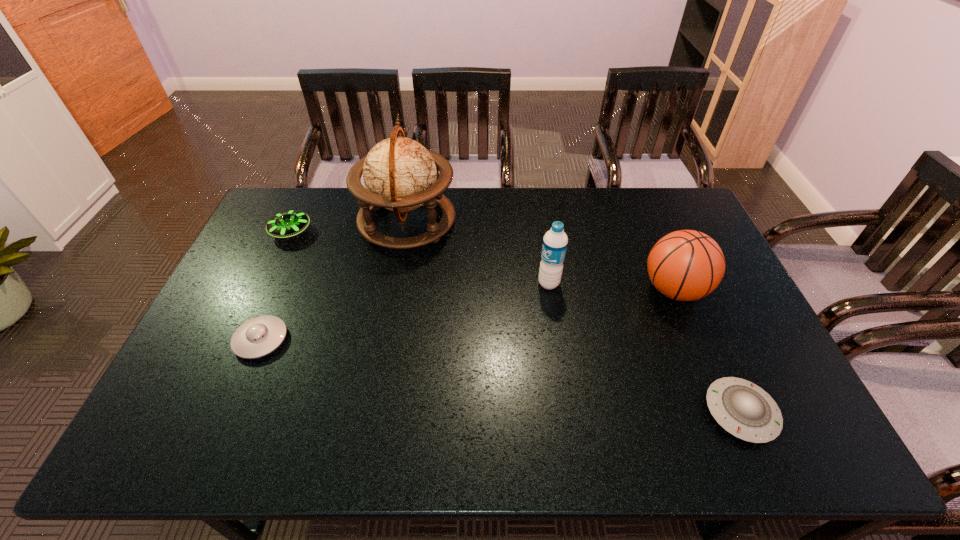
This screenshot has width=960, height=540. I want to click on free area in between the third object from right to left and the globe, so click(x=478, y=253).

Where is `vacant space that's between the basketball and the third object from right to left`? vacant space that's between the basketball and the third object from right to left is located at coordinates (612, 287).

Identify the location of vacant space that's between the third shortest object and the tallest object. The width and height of the screenshot is (960, 540). (349, 227).

Locate an element on the screen. This screenshot has height=540, width=960. vacant space that's between the fourth object from left to right and the tallest saucer is located at coordinates (420, 258).

The height and width of the screenshot is (540, 960). In order to click on vacant space that's between the tallest object and the nearest saucer in this screenshot , I will do `click(574, 317)`.

Identify the location of free space that is in between the second nearest saucer and the fourth tallest object. Image resolution: width=960 pixels, height=540 pixels. pos(276,286).

You are a GUI agent. You are given a task and a screenshot of the screen. Output one action in this format:
    pyautogui.click(x=<x>, y=<y>)
    Task: Click on the vacant area that lies between the fifth farthest object and the third object from left to right
    The image size is (960, 540).
    Given the screenshot: What is the action you would take?
    pyautogui.click(x=334, y=281)

Select which object is the closest to the basketball. Please provide its 2D coordinates. Your answer should be formatted as a tuple, i.e. [(x, y)], where the tuple contains the x and y coordinates of a point satisfying the conditions above.

[(745, 410)]

Point out which object is positioned as the second nearest to the basketball. Please provide its 2D coordinates. Your answer should be formatted as a tuple, i.e. [(x, y)], where the tuple contains the x and y coordinates of a point satisfying the conditions above.

[(555, 241)]

The image size is (960, 540). I want to click on saucer that is the second closest one to the third shortest object, so click(x=745, y=410).